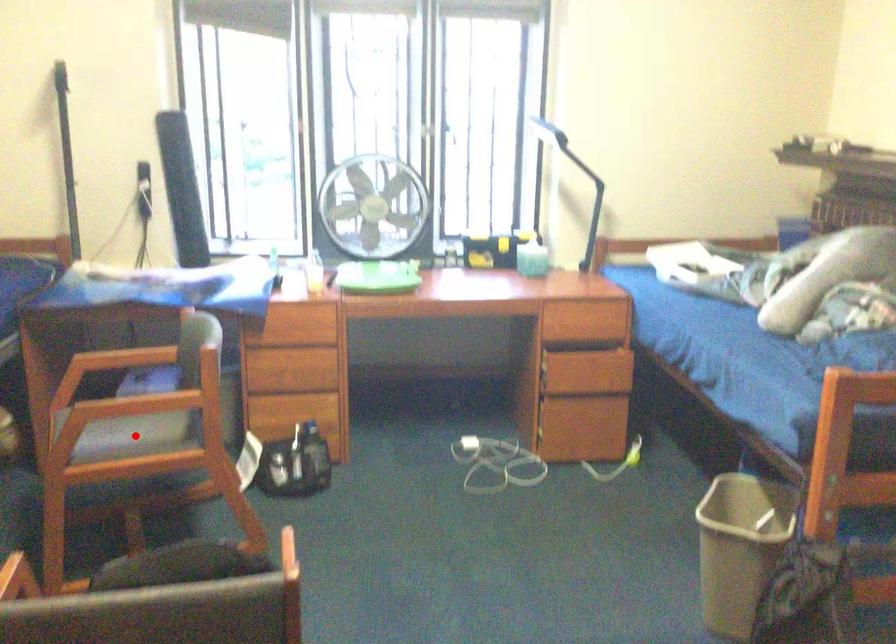
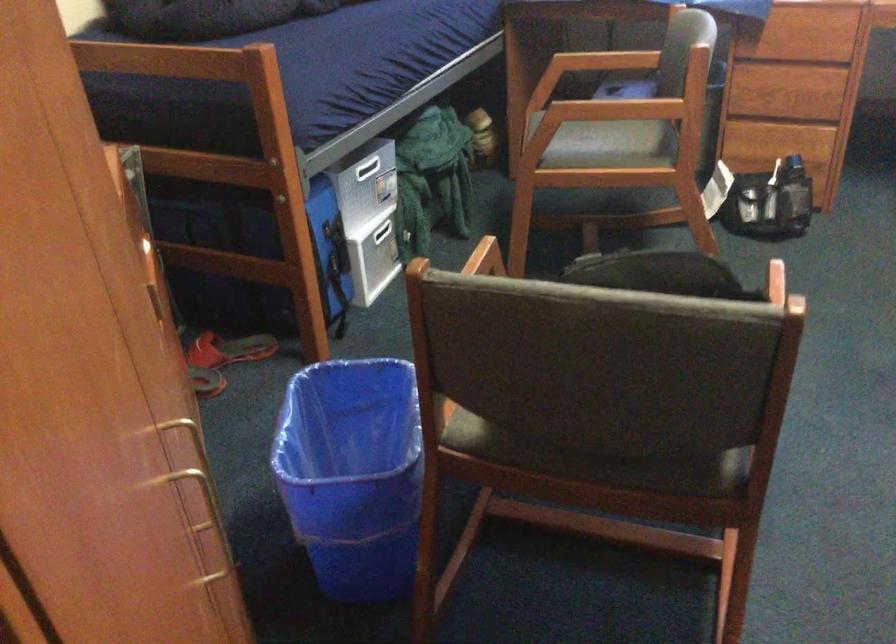
The point at the highlighted location is marked in the first image. Where is the corresponding point in the second image?

(605, 145)